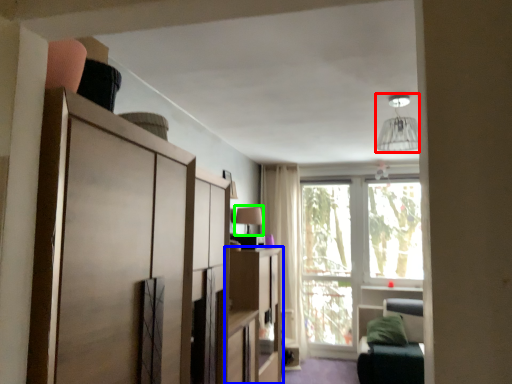
Question: Based on their relative distances, which object is farther from light fixture (highlighted by a red box)? Choose from cabinetry (highlighted by a blue box) and lamp (highlighted by a green box).

Choices:
 (A) cabinetry
 (B) lamp

Answer: (A)